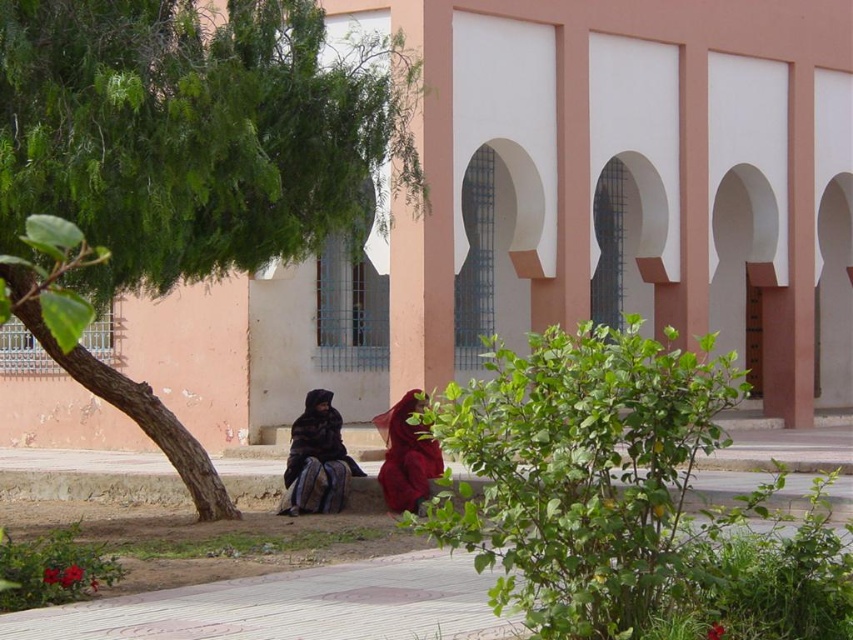
You are a photographer planning to take a picture of the green leafy tree at left and the matte red dress at lower center. Considering their sizes, which object should you focus on first to ensure it appears larger in the photo?

The green leafy tree at left is much taller than the matte red dress at lower center, so focusing on it first will ensure it appears larger in the photo.

You are a photographer trying to capture both the dark brown textured fabric at center and the matte red dress at lower center in the same frame. Based on their positions, which object should you adjust your camera to focus on first to ensure both are in the shot?

The dark brown textured fabric at center is to the left of the matte red dress at lower center. To capture both in the same frame, focus on the matte red dress at lower center first since it is closer to the center of the scene, allowing the camera to adjust for the dark brown textured fabric at center positioned to its left.